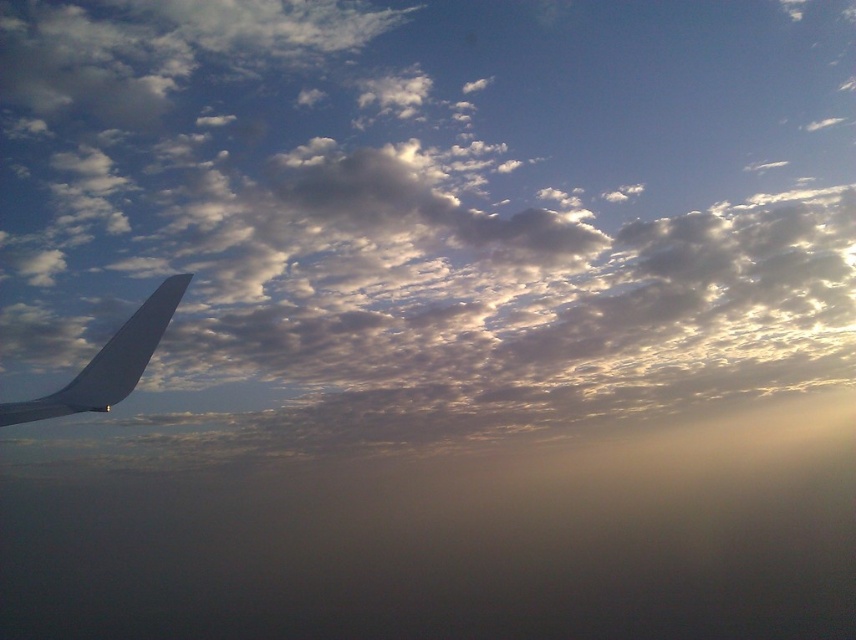
Question: Is white fluffy cloud at upper left closer to camera compared to matte gray wing at left?

Choices:
 (A) yes
 (B) no

Answer: (B)

Question: Does white fluffy cloud at upper left appear on the left side of matte gray wing at left?

Choices:
 (A) no
 (B) yes

Answer: (A)

Question: Can you confirm if white fluffy cloud at upper left is positioned below matte gray wing at left?

Choices:
 (A) yes
 (B) no

Answer: (A)

Question: Which point is farther to the camera?

Choices:
 (A) white fluffy cloud at upper left
 (B) matte gray wing at left

Answer: (A)